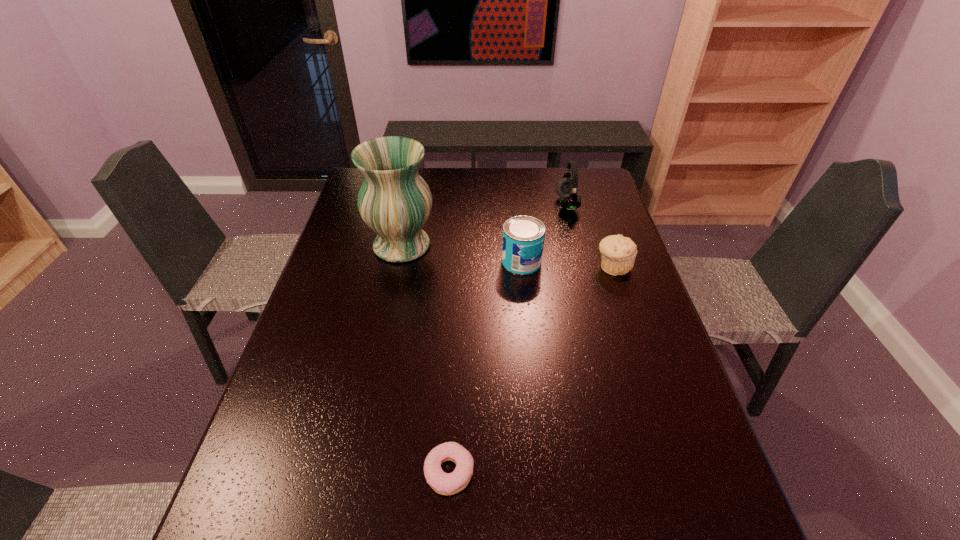
This screenshot has width=960, height=540. I want to click on vase, so click(395, 202).

Where is `the leftmost object`? The width and height of the screenshot is (960, 540). the leftmost object is located at coordinates (395, 202).

The width and height of the screenshot is (960, 540). In order to click on the second tallest object in this screenshot , I will do `click(567, 188)`.

Identify the location of headset. This screenshot has width=960, height=540. (567, 188).

Locate an element on the screen. Image resolution: width=960 pixels, height=540 pixels. the third tallest object is located at coordinates (523, 236).

Identify the location of can. This screenshot has height=540, width=960. (523, 236).

You are a GUI agent. You are given a task and a screenshot of the screen. Output one action in this format:
    pyautogui.click(x=<x>, y=<y>)
    Task: Click on the fourth tallest object
    Image resolution: width=960 pixels, height=540 pixels.
    Given the screenshot: What is the action you would take?
    pyautogui.click(x=618, y=253)

Locate an element on the screen. The width and height of the screenshot is (960, 540). the nearest object is located at coordinates (442, 483).

Where is `the shortest object`? The width and height of the screenshot is (960, 540). the shortest object is located at coordinates (442, 483).

Identify the location of vacant space located on the right of the vase. The image size is (960, 540). (521, 245).